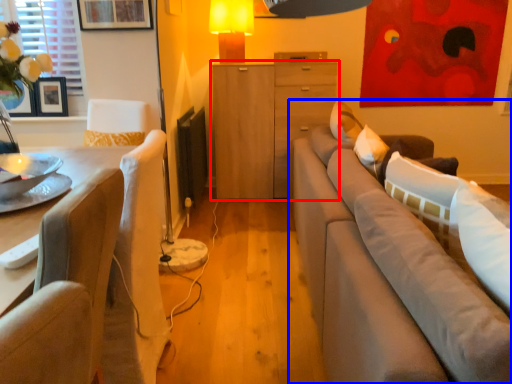
Question: Which point is further to the camera, cabinetry (highlighted by a red box) or studio couch (highlighted by a blue box)?

Choices:
 (A) cabinetry
 (B) studio couch

Answer: (A)